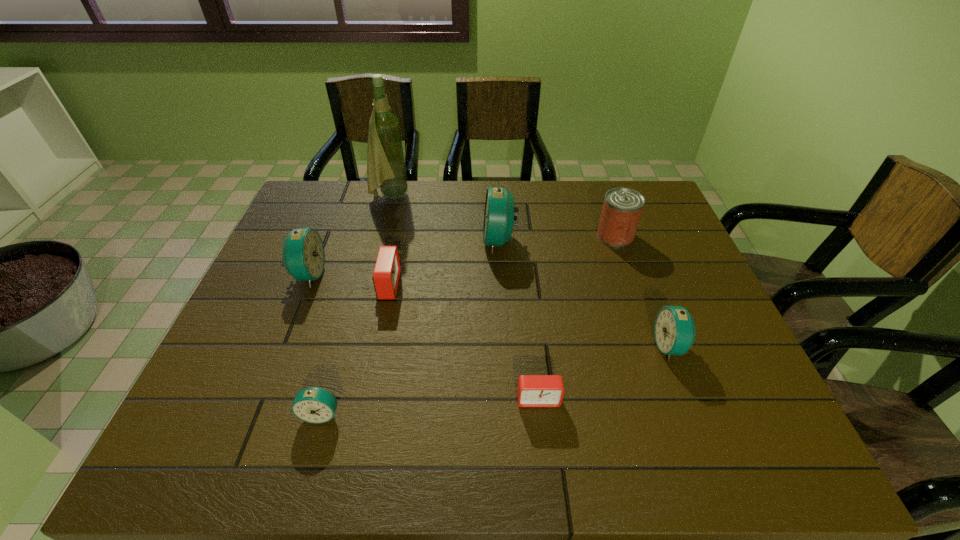
You are a GUI agent. You are given a task and a screenshot of the screen. Output one action in this format:
    pyautogui.click(x=<x>, y=<y>)
    Task: Click on the can at the right edge
    The height and width of the screenshot is (540, 960).
    Given the screenshot: What is the action you would take?
    pyautogui.click(x=622, y=208)

At what (x,y) coordinates should I click in order to perform the action: click on alarm clock located at the right edge. Please return your answer as a coordinate pair (x, y). This screenshot has height=540, width=960. Looking at the image, I should click on (674, 329).

Identify the location of vacant region at the far edge of the desktop. (573, 206).

The height and width of the screenshot is (540, 960). Find the location of `vacant space at the near edge of the desktop`. vacant space at the near edge of the desktop is located at coordinates [497, 429].

This screenshot has width=960, height=540. In order to click on vacant space at the left edge of the desktop in this screenshot , I will do `click(279, 350)`.

Identify the location of vacant space at the right edge of the desktop. This screenshot has width=960, height=540. (701, 316).

Locate an element on the screen. free space at the far left corner is located at coordinates (352, 188).

The width and height of the screenshot is (960, 540). In the image, there is a desktop. In order to click on vacant space at the near left corner in this screenshot , I will do `click(243, 427)`.

Find the location of a particular element. This screenshot has height=540, width=960. free point between the shortest object and the leftmost object is located at coordinates (423, 337).

The width and height of the screenshot is (960, 540). Identify the location of vacant area that lies between the can and the tallest alarm clock. (558, 238).